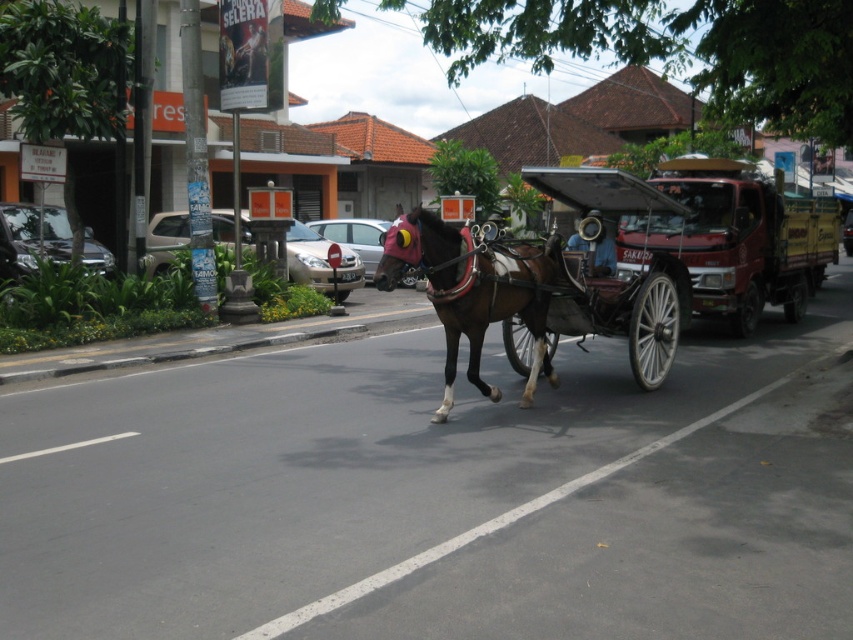
In the scene shown: You are a delivery person needing to pass through a narrow alley that is only as wide as the wooden cart at center. Can your delivery van, which is as wide as the brown glossy horse at center, fit through the alley without any adjustments?

The wooden cart at center is wider than the brown glossy horse at center. Since the alley is as wide as the wooden cart at center, the delivery van, which is as wide as the brown glossy horse at center, can fit through the alley because it is narrower than the alley width.

You are a delivery person trying to navigate through a narrow alleyway that is only 1.5 meters wide. You need to pass by the metallic red horse cart at center and the brown glossy horse at center. Can both objects fit side by side in the alleyway?

The metallic red horse cart at center has a lesser width compared to brown glossy horse at center. However, since the alleyway is only 1.5 meters wide, it is unlikely both the metallic red horse cart at center and the brown glossy horse at center can fit side by side due to their combined width exceeding the alleyway width.